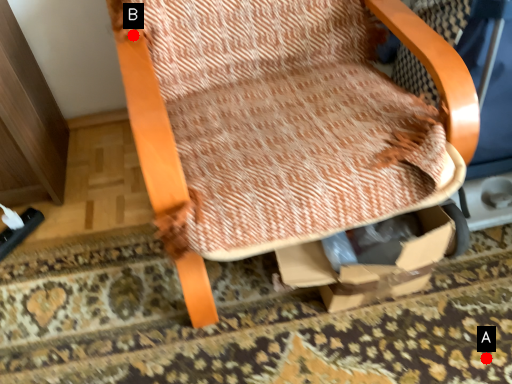
Question: Two points are circled on the image, labeled by A and B beside each circle. Among these points, which one is farthest from the camera?

Choices:
 (A) A is further
 (B) B is further

Answer: (A)